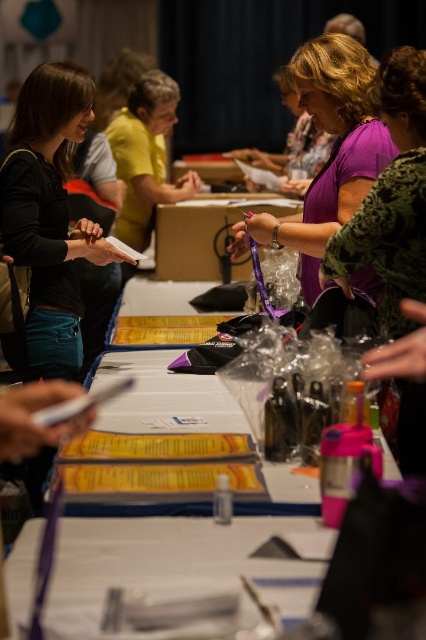
Can you confirm if yellow paper at center is shorter than matte yellow shirt at upper center?

Indeed, yellow paper at center has a lesser height compared to matte yellow shirt at upper center.

The image size is (426, 640). I want to click on yellow paper at center, so pyautogui.click(x=152, y=560).

I want to click on yellow paper at center, so click(x=152, y=560).

Does point (17, 168) come farther from viewer compared to point (417, 163)?

Yes, it is behind point (417, 163).

Can you confirm if matte black shirt at left is positioned above purple matte shirt at upper right?

Indeed, matte black shirt at left is positioned over purple matte shirt at upper right.

Is point (32, 321) in front of point (388, 102)?

No.

Find the location of a particular element. matte black shirt at left is located at coordinates (49, 216).

Does point (37, 157) come behind point (307, 52)?

Yes, it is.

Between matte black shirt at left and purple matte shirt at center, which one is positioned higher?

purple matte shirt at center

Measure the distance between point [83,122] and camera.

2.26 meters

I want to click on matte black shirt at left, so click(49, 216).